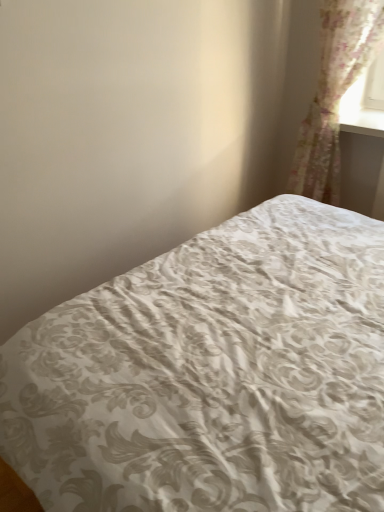
Find the location of a particular element. This screenshot has width=384, height=512. white damask fabric bed at center is located at coordinates (212, 375).

The image size is (384, 512). Describe the element at coordinates (212, 375) in the screenshot. I see `white damask fabric bed at center` at that location.

What is the approximate height of white damask fabric bed at center?

32.56 inches.

Measure the distance between point (333,138) and camera.

The depth of point (333,138) is 7.36 feet.

This screenshot has width=384, height=512. Describe the element at coordinates (334, 93) in the screenshot. I see `translucent floral fabric at upper right` at that location.

Where is `translucent floral fabric at upper right`? The image size is (384, 512). translucent floral fabric at upper right is located at coordinates (334, 93).

Identify the location of white damask fabric bed at center. The image size is (384, 512). (212, 375).

Consider the image. Can you confirm if translucent floral fabric at upper right is positioned to the left of white damask fabric bed at center?

In fact, translucent floral fabric at upper right is to the right of white damask fabric bed at center.

Based on the photo, is translucent floral fabric at upper right positioned before white damask fabric bed at center?

No.

Is point (342, 92) more distant than point (208, 506)?

That is True.

From the image's perspective, is translucent floral fabric at upper right below white damask fabric bed at center?

Actually, translucent floral fabric at upper right appears above white damask fabric bed at center in the image.

From a real-world perspective, is translucent floral fabric at upper right beneath white damask fabric bed at center?

No, from a real-world perspective, translucent floral fabric at upper right is not under white damask fabric bed at center.

Considering the relative sizes of translucent floral fabric at upper right and white damask fabric bed at center in the image provided, is translucent floral fabric at upper right wider than white damask fabric bed at center?

No.

Is translucent floral fabric at upper right shorter than white damask fabric bed at center?

In fact, translucent floral fabric at upper right may be taller than white damask fabric bed at center.

Does translucent floral fabric at upper right have a larger size compared to white damask fabric bed at center?

Incorrect, translucent floral fabric at upper right is not larger than white damask fabric bed at center.

Is translucent floral fabric at upper right situated inside white damask fabric bed at center or outside?

translucent floral fabric at upper right is not enclosed by white damask fabric bed at center.

Would you consider translucent floral fabric at upper right to be distant from white damask fabric bed at center?

Indeed, translucent floral fabric at upper right is not near white damask fabric bed at center.

Is translucent floral fabric at upper right turned away from white damask fabric bed at center?

translucent floral fabric at upper right is not turned away from white damask fabric bed at center.

How many degrees apart are the facing directions of translucent floral fabric at upper right and white damask fabric bed at center?

91.1 degrees.

Measure the distance between translucent floral fabric at upper right and white damask fabric bed at center.

4.29 feet.

At what (x,y) coordinates should I click in order to perform the action: click on bed that appears in front of the translucent floral fabric at upper right. Please return your answer as a coordinate pair (x, y). Looking at the image, I should click on (212, 375).

Considering the relative positions of white damask fabric bed at center and translucent floral fabric at upper right in the image provided, is white damask fabric bed at center to the left of translucent floral fabric at upper right from the viewer's perspective?

Yes.

Does white damask fabric bed at center come behind translucent floral fabric at upper right?

No, white damask fabric bed at center is closer to the viewer.

Which is nearer, (351, 413) or (316, 186)?

Point (351, 413) is positioned closer to the camera compared to point (316, 186).

From the image's perspective, is white damask fabric bed at center above translucent floral fabric at upper right?

Incorrect, from the image's perspective, white damask fabric bed at center is lower than translucent floral fabric at upper right.

From a real-world perspective, relative to translucent floral fabric at upper right, is white damask fabric bed at center vertically above or below?

From a real-world perspective, white damask fabric bed at center is physically below translucent floral fabric at upper right.

Considering the relative sizes of white damask fabric bed at center and translucent floral fabric at upper right in the image provided, is white damask fabric bed at center thinner than translucent floral fabric at upper right?

No, white damask fabric bed at center is not thinner than translucent floral fabric at upper right.

Which of these two, white damask fabric bed at center or translucent floral fabric at upper right, stands taller?

Standing taller between the two is translucent floral fabric at upper right.

Looking at the image, does white damask fabric bed at center seem bigger or smaller compared to translucent floral fabric at upper right?

In the image, white damask fabric bed at center appears to be larger than translucent floral fabric at upper right.

Based on the photo, could translucent floral fabric at upper right be considered to be inside white damask fabric bed at center?

Actually, translucent floral fabric at upper right is outside white damask fabric bed at center.

Are white damask fabric bed at center and translucent floral fabric at upper right beside each other?

white damask fabric bed at center and translucent floral fabric at upper right are clearly separated.

Based on the photo, is white damask fabric bed at center positioned with its back to translucent floral fabric at upper right?

No, white damask fabric bed at center is not facing the opposite direction of translucent floral fabric at upper right.

Looking at this image, how many degrees apart are the facing directions of white damask fabric bed at center and translucent floral fabric at upper right?

They differ by 91.1 degrees in their facing directions.

Identify the location of bed in front of the translucent floral fabric at upper right. This screenshot has width=384, height=512. (212, 375).

Find the location of `bed in front of the translucent floral fabric at upper right`. bed in front of the translucent floral fabric at upper right is located at coordinates (212, 375).

Where is `curtain located above the white damask fabric bed at center (from the image's perspective)`? The height and width of the screenshot is (512, 384). curtain located above the white damask fabric bed at center (from the image's perspective) is located at coordinates (334, 93).